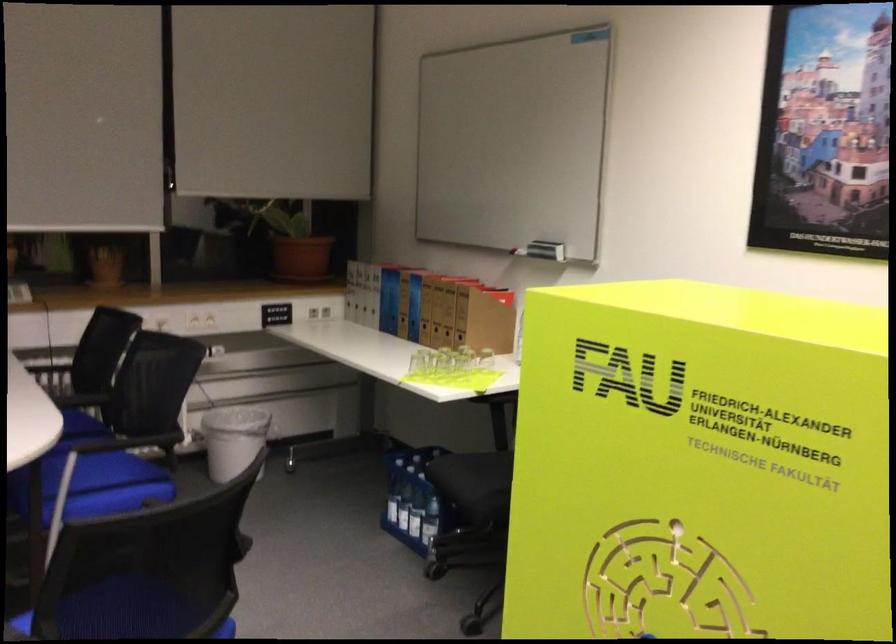
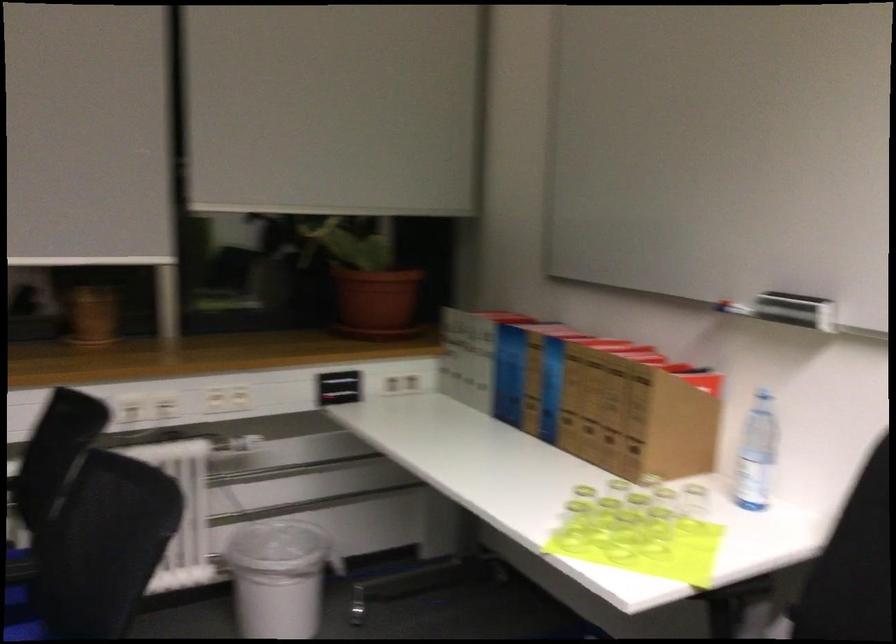
Locate, in the second image, the point that corresponds to (x=420, y=372) in the first image.

(573, 526)